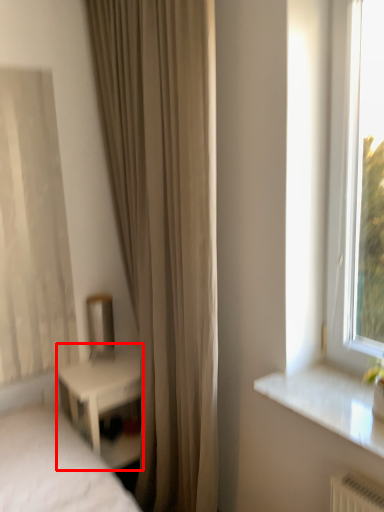
Question: Where is nightstand (annotated by the red box) located in relation to curtain in the image?

Choices:
 (A) left
 (B) right

Answer: (A)